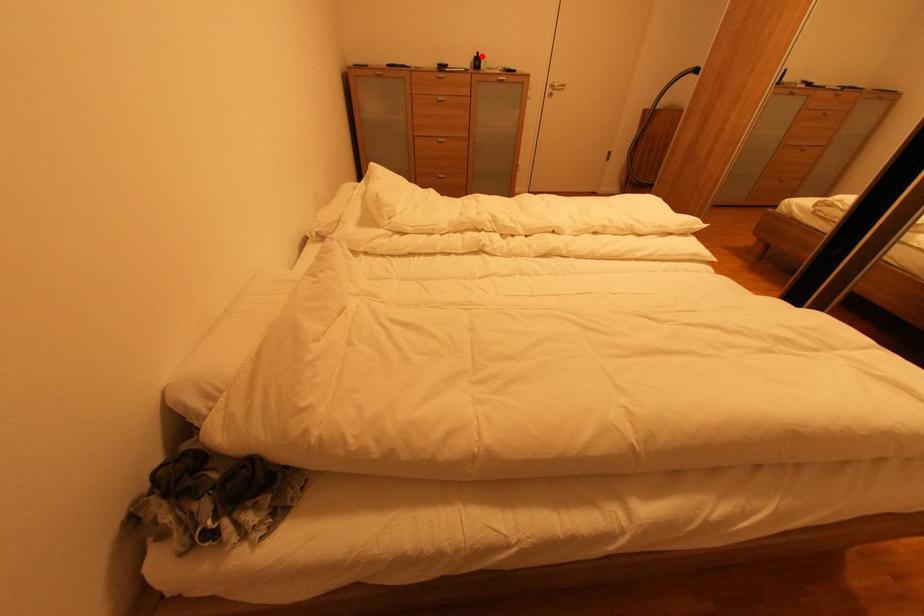
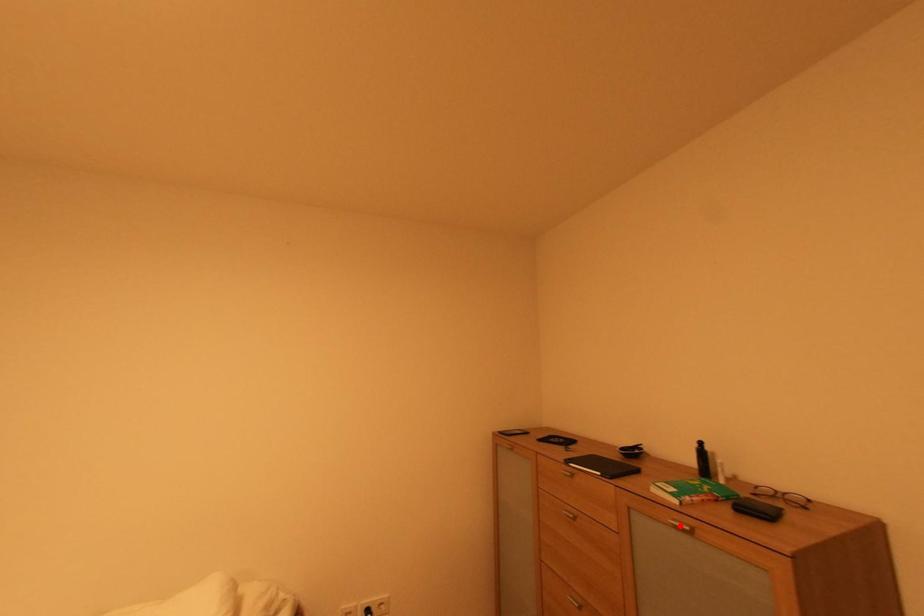
I am providing you with two images of the same scene from different viewpoints. A red point is marked on the first image and another point is marked on the second image. Is the marked point in image1 the same physical position as the marked point in image2?

No